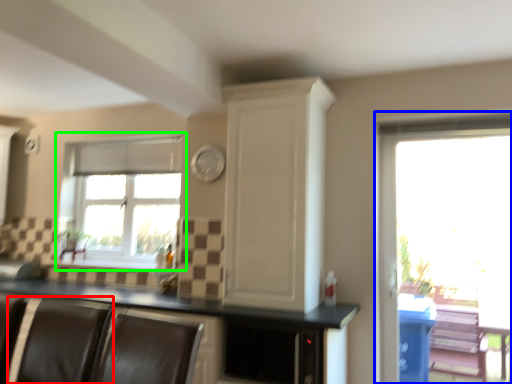
Question: Estimate the real-world distances between objects in this image. Which object is farther from armchair (highlighted by a red box), window (highlighted by a blue box) or window (highlighted by a green box)?

Choices:
 (A) window
 (B) window

Answer: (A)